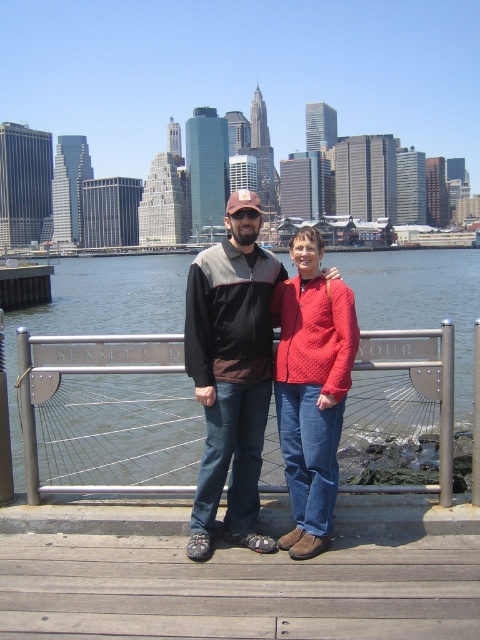
You are a photographer standing on the wooden deck. You want to take a photo of the clear water at center and the quilted red sweater at center. How far apart are these two objects in the scene?

The clear water at center and quilted red sweater at center are 57.30 meters apart from each other.

You are a photographer planning to capture a landscape shot of the clear water at center and the quilted red sweater at center. Based on their relative heights, which object should you focus on first to ensure proper framing?

The clear water at center has a greater height compared to the quilted red sweater at center, so you should focus on the clear water at center first to ensure proper framing.

You are a photographer trying to capture a portrait of the two people in the scene. The matte black jacket at center and the quilted red sweater at center are both in the frame. Based on their positions, which one is positioned higher in the image?

The matte black jacket at center is located above the quilted red sweater at center, so it is positioned higher in the image.